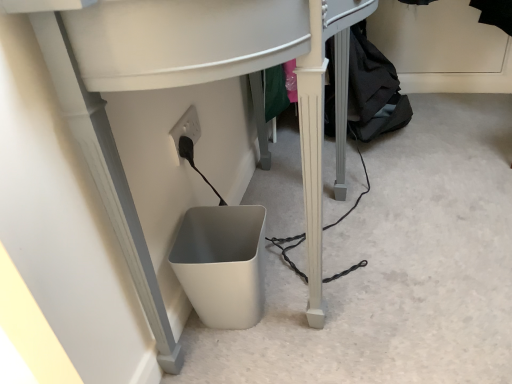
Locate an element on the screen. Image resolution: width=512 pixels, height=384 pixels. free spot to the right of white matte waste container at lower center is located at coordinates (306, 299).